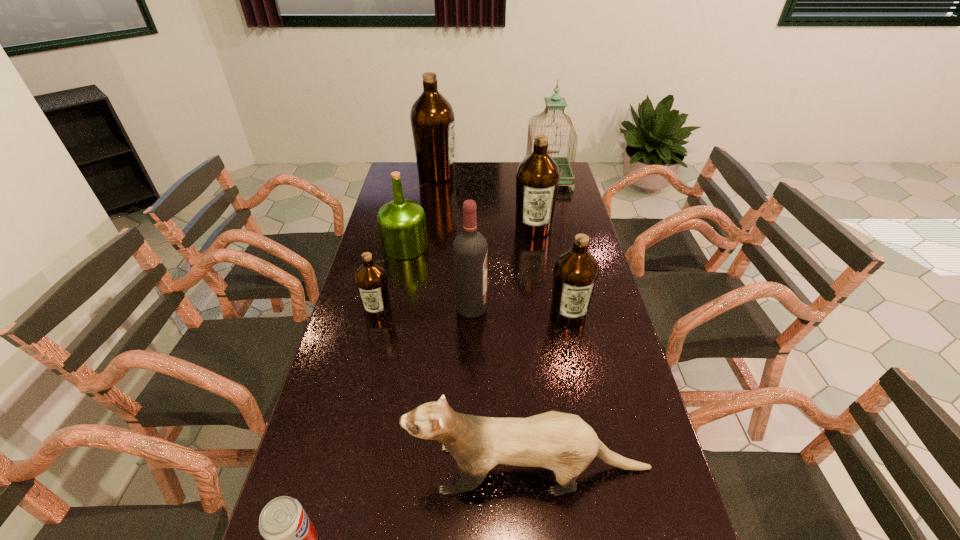
Select which olive oil is the third closest to the smallest brown olive oil. Please provide its 2D coordinates. Your answer should be formatted as a tuple, i.e. [(x, y)], where the tuple contains the x and y coordinates of a point satisfying the conditions above.

[(537, 178)]

Identify which brown olive oil is the third closest to the shortest olive oil. Please provide its 2D coordinates. Your answer should be formatted as a tuple, i.e. [(x, y)], where the tuple contains the x and y coordinates of a point satisfying the conditions above.

[(432, 118)]

Find the location of a particular element. This screenshot has height=540, width=960. brown olive oil that is the second closest to the wine bottle is located at coordinates (371, 279).